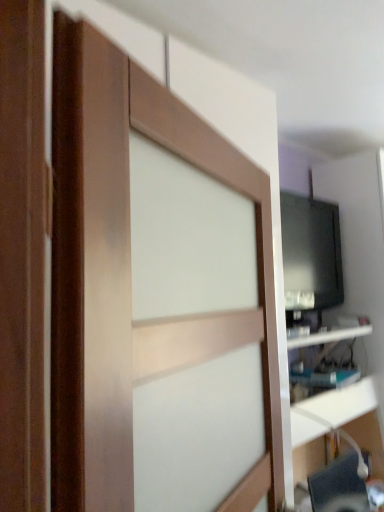
Question: Does wooden barn door at center have a larger size compared to white glossy shelf at right?

Choices:
 (A) no
 (B) yes

Answer: (B)

Question: Can you confirm if wooden barn door at center is wider than white glossy shelf at right?

Choices:
 (A) no
 (B) yes

Answer: (A)

Question: Is wooden barn door at center facing away from white glossy shelf at right?

Choices:
 (A) yes
 (B) no

Answer: (B)

Question: Can you confirm if wooden barn door at center is thinner than white glossy shelf at right?

Choices:
 (A) no
 (B) yes

Answer: (B)

Question: From the image's perspective, is wooden barn door at center on white glossy shelf at right?

Choices:
 (A) yes
 (B) no

Answer: (A)

Question: Considering the relative positions of wooden barn door at center and white glossy shelf at right in the image provided, is wooden barn door at center to the right of white glossy shelf at right from the viewer's perspective?

Choices:
 (A) no
 (B) yes

Answer: (A)

Question: Can you confirm if wooden barn door at center is positioned to the right of gray fabric computer chair at lower right?

Choices:
 (A) no
 (B) yes

Answer: (A)

Question: Does wooden barn door at center have a lesser width compared to gray fabric computer chair at lower right?

Choices:
 (A) yes
 (B) no

Answer: (A)

Question: Is wooden barn door at center directly adjacent to gray fabric computer chair at lower right?

Choices:
 (A) yes
 (B) no

Answer: (B)

Question: Is wooden barn door at center oriented towards gray fabric computer chair at lower right?

Choices:
 (A) yes
 (B) no

Answer: (B)

Question: Considering the relative sizes of wooden barn door at center and gray fabric computer chair at lower right in the image provided, is wooden barn door at center taller than gray fabric computer chair at lower right?

Choices:
 (A) yes
 (B) no

Answer: (A)

Question: From the image's perspective, would you say wooden barn door at center is shown under gray fabric computer chair at lower right?

Choices:
 (A) no
 (B) yes

Answer: (A)

Question: Does black glossy monitor at right appear on the left side of black glossy tv at upper right?

Choices:
 (A) no
 (B) yes

Answer: (B)